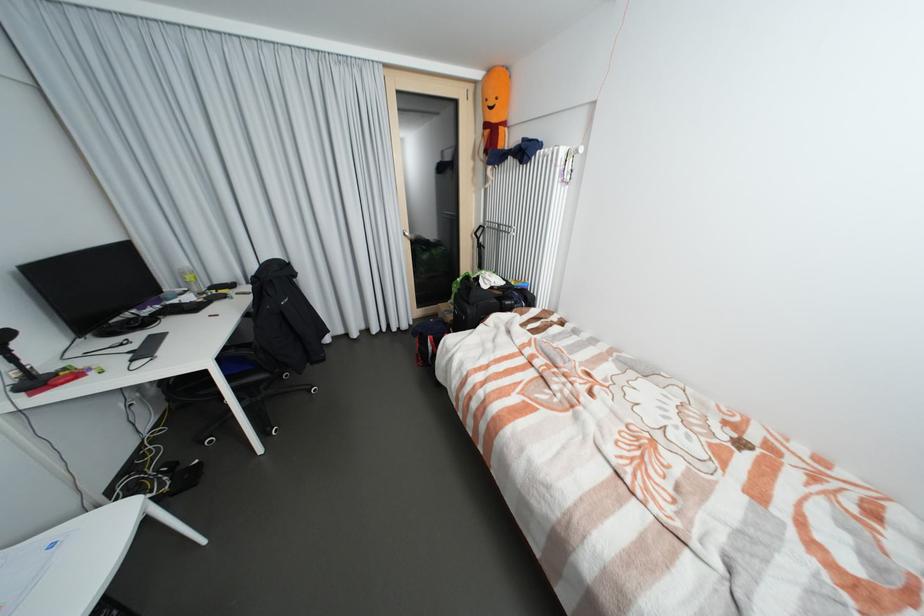
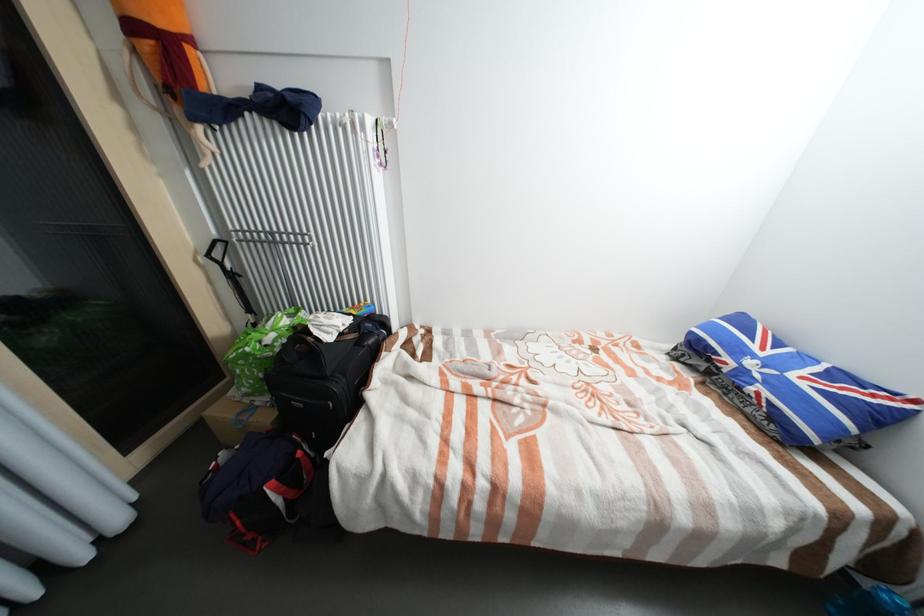
In the second image, find the point that corresponds to the point at 458,304 in the first image.

(253, 395)